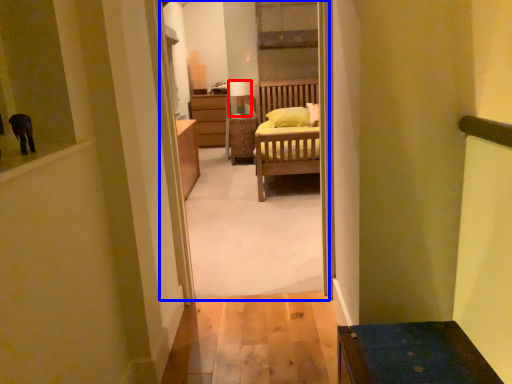
Question: Which point is further to the camera, lamp (highlighted by a red box) or corridor (highlighted by a blue box)?

Choices:
 (A) lamp
 (B) corridor

Answer: (A)